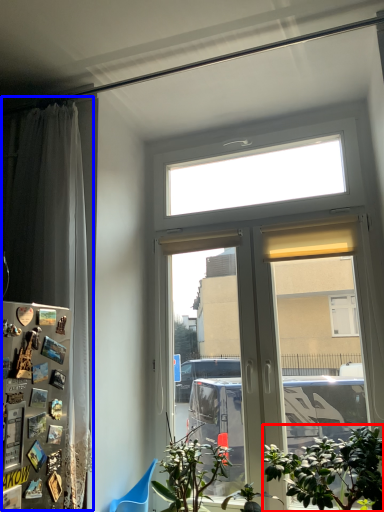
Question: Which of the following is the closest to the observer, houseplant (highlighted by a red box) or curtain (highlighted by a blue box)?

Choices:
 (A) houseplant
 (B) curtain

Answer: (A)